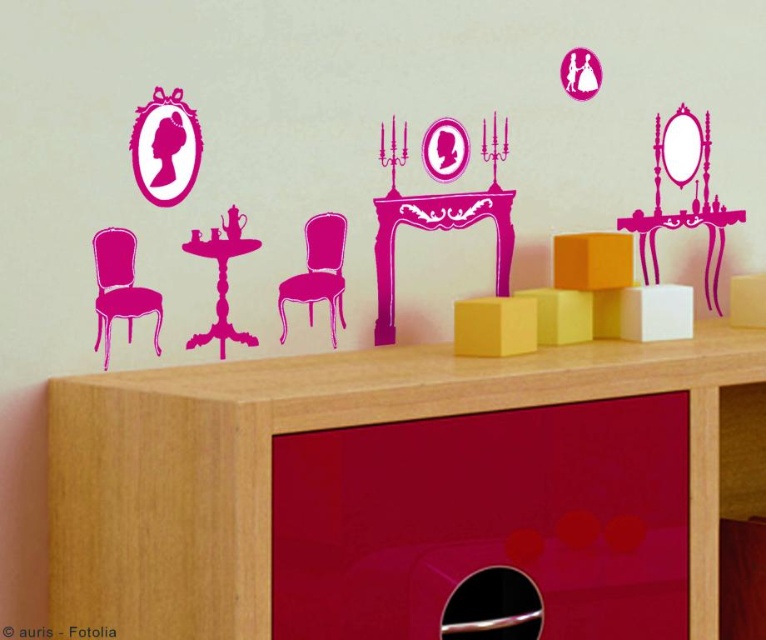
Question: Is wooden dresser at lower center bigger than pink glossy vanity table at center?

Choices:
 (A) no
 (B) yes

Answer: (B)

Question: Does pink glossy vanity table at center come behind pink glossy chair at center?

Choices:
 (A) no
 (B) yes

Answer: (B)

Question: Can you confirm if pink glossy vanity table at center is wider than matte pink chair at left?

Choices:
 (A) no
 (B) yes

Answer: (B)

Question: Which of the following is the closest to the observer?

Choices:
 (A) (318, 243)
 (B) (496, 275)
 (C) (133, 296)

Answer: (C)

Question: Which object is closer to the camera taking this photo?

Choices:
 (A) pink glossy chair at center
 (B) matte pink chair at left
 (C) pink glossy vanity table at center

Answer: (B)

Question: Which of the following is the closest to the observer?

Choices:
 (A) tap(149, 392)
 (B) tap(228, 227)
 (C) tap(452, 212)

Answer: (A)